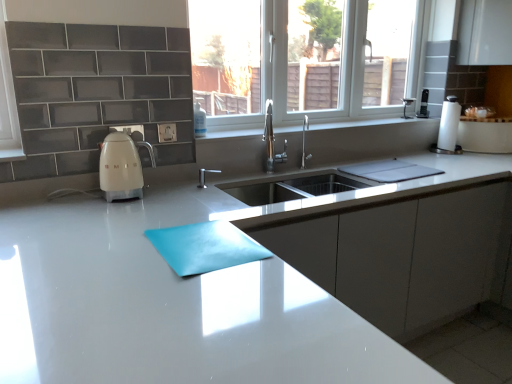
Question: Would you say white glossy countertop at center is part of white paper towel at right's contents?

Choices:
 (A) yes
 (B) no

Answer: (B)

Question: Is white paper towel at right wider than white glossy countertop at center?

Choices:
 (A) no
 (B) yes

Answer: (A)

Question: From a real-world perspective, is white paper towel at right physically above white glossy countertop at center?

Choices:
 (A) yes
 (B) no

Answer: (A)

Question: Would you say white paper towel at right is a long distance from white glossy countertop at center?

Choices:
 (A) yes
 (B) no

Answer: (A)

Question: From a real-world perspective, is white paper towel at right below white glossy countertop at center?

Choices:
 (A) no
 (B) yes

Answer: (A)

Question: Is white paper towel at right directly adjacent to white glossy countertop at center?

Choices:
 (A) yes
 (B) no

Answer: (B)

Question: Is white glossy kettle at left touching teal glossy placemat at center?

Choices:
 (A) yes
 (B) no

Answer: (B)

Question: Could you tell me if white glossy kettle at left is facing teal glossy placemat at center?

Choices:
 (A) no
 (B) yes

Answer: (B)

Question: Can you confirm if white glossy kettle at left is taller than teal glossy placemat at center?

Choices:
 (A) no
 (B) yes

Answer: (B)

Question: Considering the relative sizes of white glossy kettle at left and teal glossy placemat at center in the image provided, is white glossy kettle at left shorter than teal glossy placemat at center?

Choices:
 (A) no
 (B) yes

Answer: (A)

Question: Does white glossy kettle at left lie behind teal glossy placemat at center?

Choices:
 (A) no
 (B) yes

Answer: (B)

Question: From the image's perspective, is white glossy kettle at left over teal glossy placemat at center?

Choices:
 (A) no
 (B) yes

Answer: (B)

Question: Is white glossy kettle at left bigger than white glossy countertop at center?

Choices:
 (A) no
 (B) yes

Answer: (A)